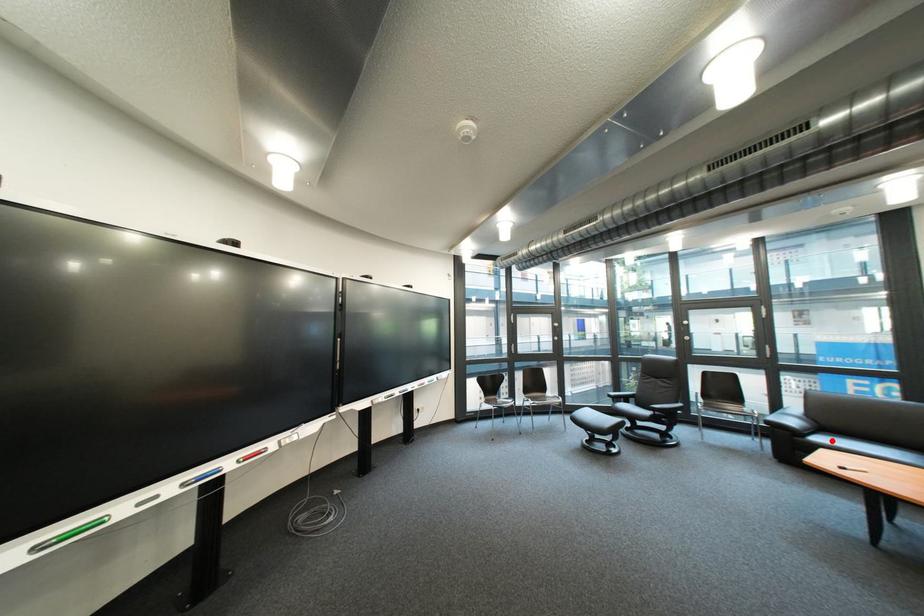
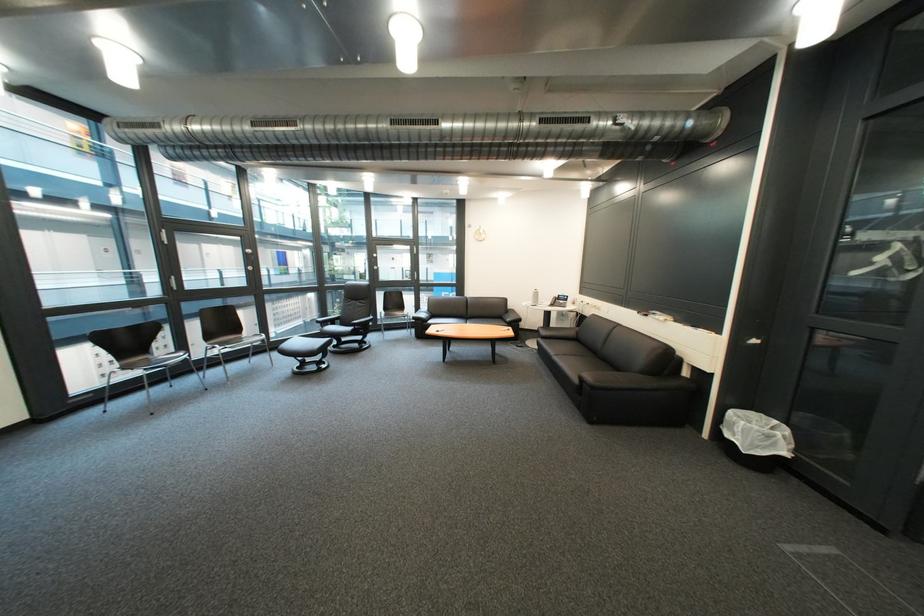
Question: I am providing you with two images of the same scene from different viewpoints. Image1 has a red point marked. In image2, the corresponding 3D location appears at what relative position? Reply with the corresponding letter.

Choices:
 (A) Closer
 (B) Farther

Answer: (B)